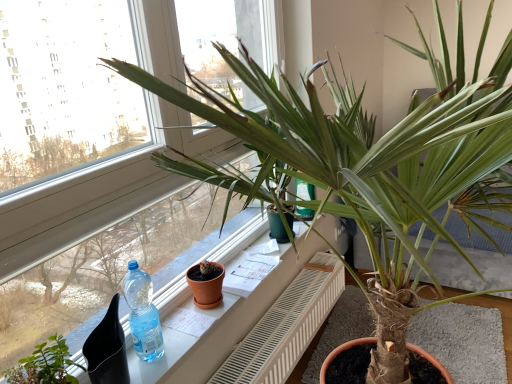
Question: In the image, is transparent plastic bottle at window on the left side or the right side of terracotta clay pot at center?

Choices:
 (A) right
 (B) left

Answer: (B)

Question: Considering the positions of point (137, 288) and point (194, 291), is point (137, 288) closer or farther from the camera than point (194, 291)?

Choices:
 (A) farther
 (B) closer

Answer: (B)

Question: Which is farther from the transparent plastic bottle at window?

Choices:
 (A) green matte plant at lower left
 (B) green leafy plant at upper center
 (C) terracotta clay pot at center
 (D) white plastic radiator at center
 (E) white glossy window sill at center

Answer: (D)

Question: Which of these objects is positioned closest to the white plastic radiator at center?

Choices:
 (A) transparent plastic bottle at window
 (B) white glossy window sill at center
 (C) green matte plant at lower left
 (D) green leafy plant at upper center
 (E) terracotta clay pot at center

Answer: (B)